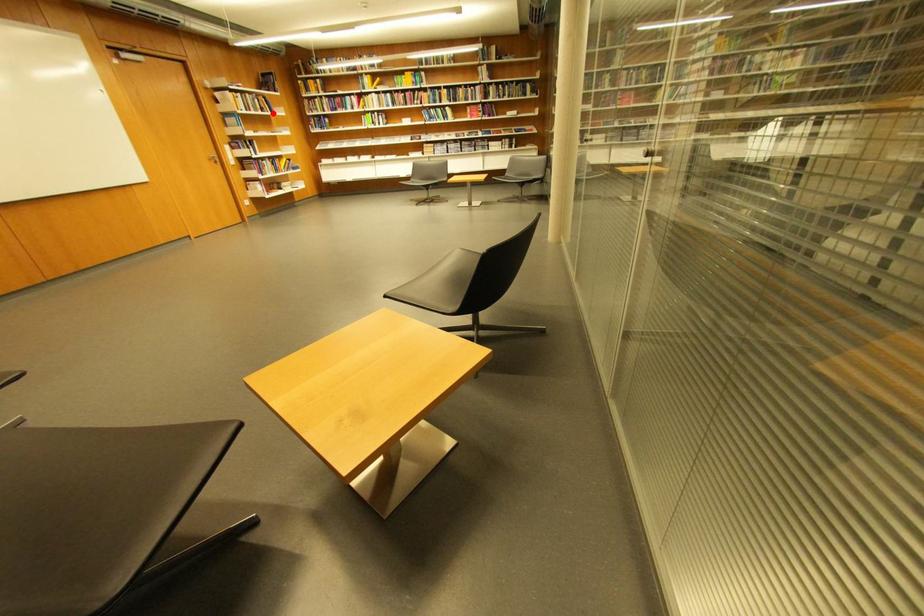
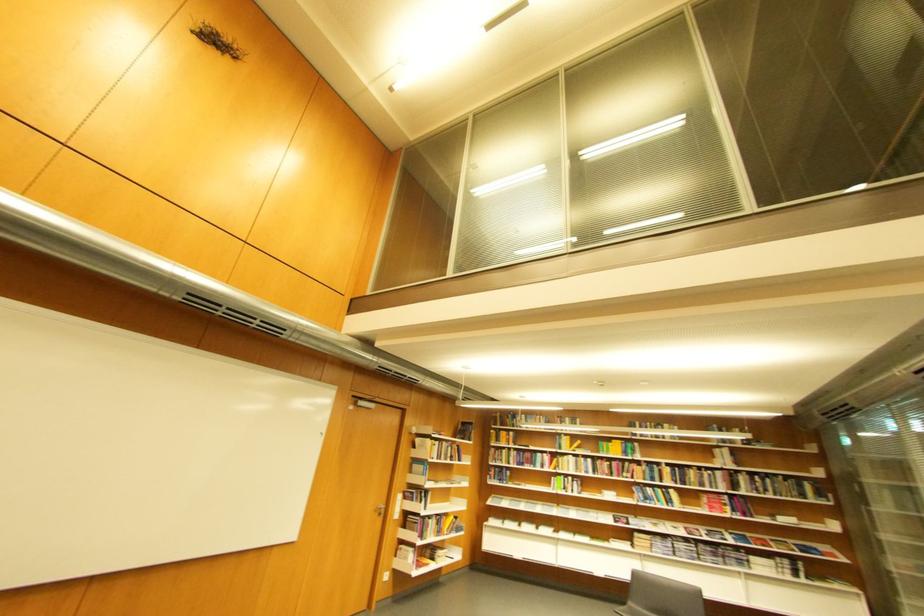
In the second image, find the point that corresponds to the highlighted location in the first image.

(460, 461)